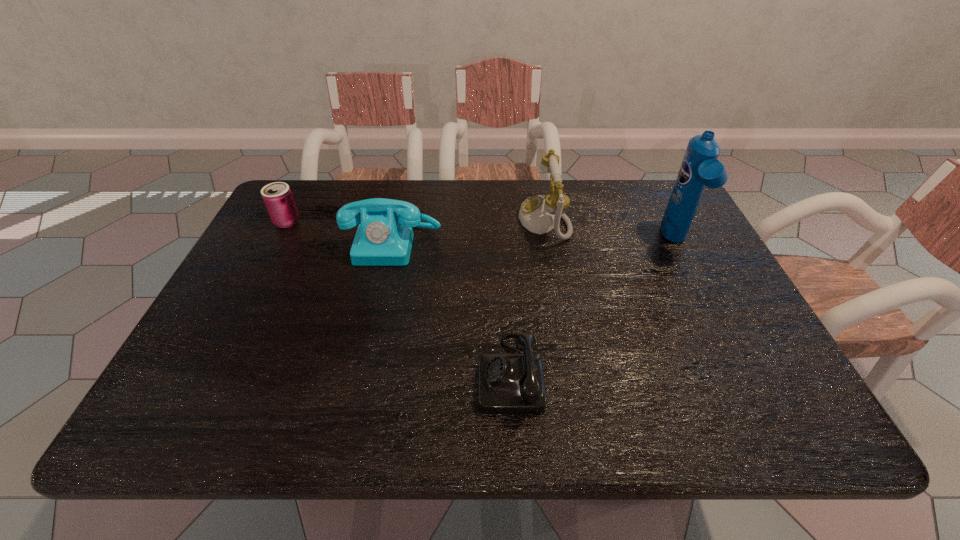
This screenshot has height=540, width=960. Identify the location of free spot at the near right corner of the desktop. (754, 404).

At what (x,y) coordinates should I click in order to perform the action: click on blank region between the tallest object and the second shortest telephone. Please return your answer as a coordinate pair (x, y). Image resolution: width=960 pixels, height=540 pixels. Looking at the image, I should click on (535, 242).

What are the coordinates of `unoccupied position between the nearest telephone and the tallest object` in the screenshot? It's located at (593, 307).

I want to click on empty space that is in between the leftmost telephone and the nearest telephone, so click(451, 308).

This screenshot has height=540, width=960. Find the location of `free space between the tallest object and the nearest object`. free space between the tallest object and the nearest object is located at coordinates (593, 307).

Where is `free space between the shampoo and the second object from left to right`? free space between the shampoo and the second object from left to right is located at coordinates (535, 242).

Where is `free spot between the leftmost object and the second shortest telephone`? This screenshot has height=540, width=960. free spot between the leftmost object and the second shortest telephone is located at coordinates (340, 233).

Locate an element on the screen. The image size is (960, 540). blank region between the tallest telephone and the second object from left to right is located at coordinates (468, 232).

Find the location of `free area in between the second tallest object and the third shortest object`. free area in between the second tallest object and the third shortest object is located at coordinates (468, 232).

Locate an element on the screen. This screenshot has height=540, width=960. free point between the second tallest telephone and the rightmost object is located at coordinates (535, 242).